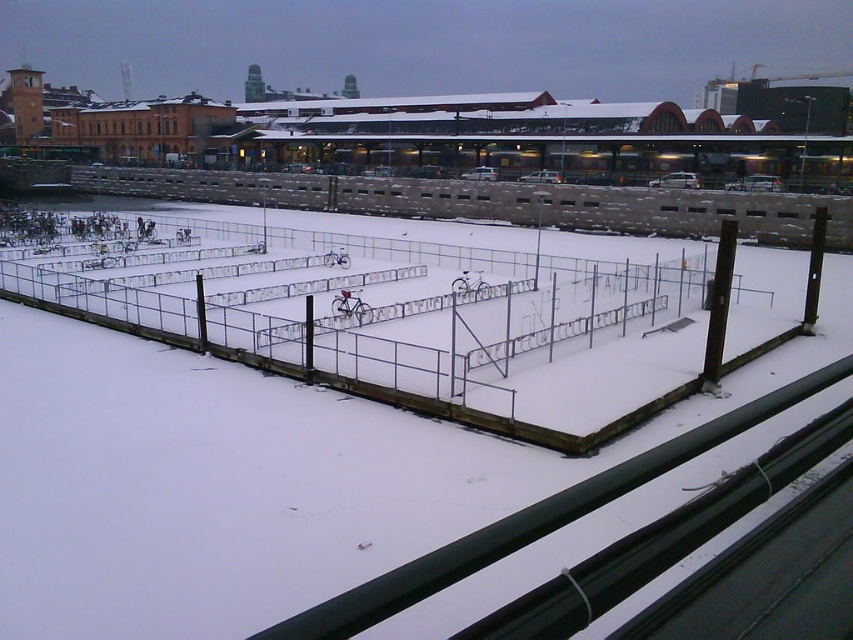
Does metallic silver fence at center have a smaller size compared to brown concrete fence at upper center?

Indeed, metallic silver fence at center has a smaller size compared to brown concrete fence at upper center.

Between point (729, 355) and point (498, 204), which one is positioned behind?

The point (498, 204) is more distant.

Locate an element on the screen. metallic silver fence at center is located at coordinates (434, 330).